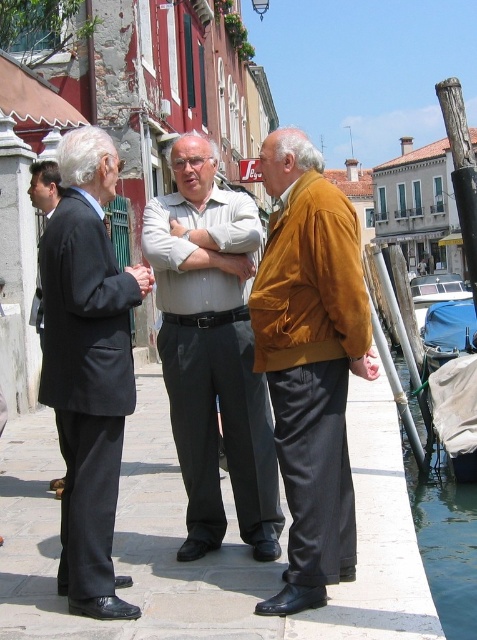
Question: Does matte black suit at left have a larger size compared to black suit coat at left?

Choices:
 (A) no
 (B) yes

Answer: (A)

Question: Which is nearer to the matte black suit at left?

Choices:
 (A) matte orange jacket at center
 (B) light gray cotton shirt at center
 (C) clear blue water at lower right
 (D) black suit coat at left

Answer: (B)

Question: Among these objects, which one is farthest from the camera?

Choices:
 (A) clear blue water at lower right
 (B) matte black suit at left
 (C) light gray cotton shirt at center
 (D) black suit coat at left

Answer: (D)

Question: Can you confirm if matte black suit at left is wider than black suit coat at left?

Choices:
 (A) yes
 (B) no

Answer: (B)

Question: Based on their relative distances, which object is nearer to the clear blue water at lower right?

Choices:
 (A) light gray cotton shirt at center
 (B) black suit coat at left

Answer: (A)

Question: Can you confirm if light gray cotton shirt at center is positioned to the right of black suit coat at left?

Choices:
 (A) no
 (B) yes

Answer: (B)